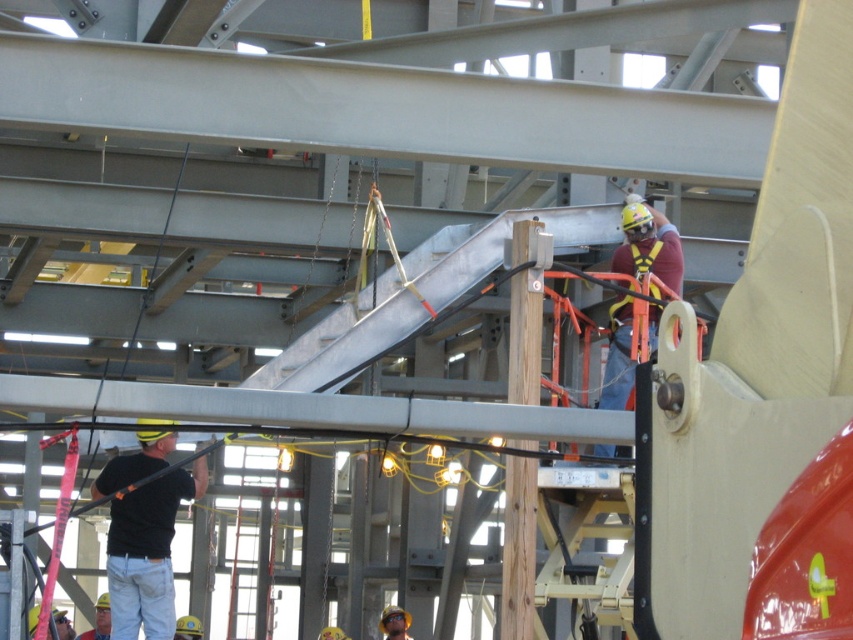
Can you confirm if black matte shirt at lower left is shorter than yellow hard hat at lower left?

Yes.

Is black matte shirt at lower left below yellow hard hat at lower left?

No, black matte shirt at lower left is not below yellow hard hat at lower left.

Is point (111, 541) farther from camera compared to point (99, 618)?

No, (111, 541) is in front of (99, 618).

Identify the location of black matte shirt at lower left. The width and height of the screenshot is (853, 640). (148, 552).

In the scene shown: Does metallic gray beam at center lie in front of black matte shirt at lower left?

Yes, metallic gray beam at center is in front of black matte shirt at lower left.

Does metallic gray beam at center have a greater height compared to black matte shirt at lower left?

Incorrect, metallic gray beam at center's height is not larger of black matte shirt at lower left's.

This screenshot has height=640, width=853. Identify the location of metallic gray beam at center. (312, 410).

Is point (61, 113) more distant than point (103, 385)?

No.

Can you confirm if gray metallic beam at upper center is smaller than metallic gray beam at center?

Indeed, gray metallic beam at upper center has a smaller size compared to metallic gray beam at center.

Is point (184, 51) positioned in front of point (48, 394)?

Yes.

The image size is (853, 640). Find the location of `gray metallic beam at upper center`. gray metallic beam at upper center is located at coordinates (381, 109).